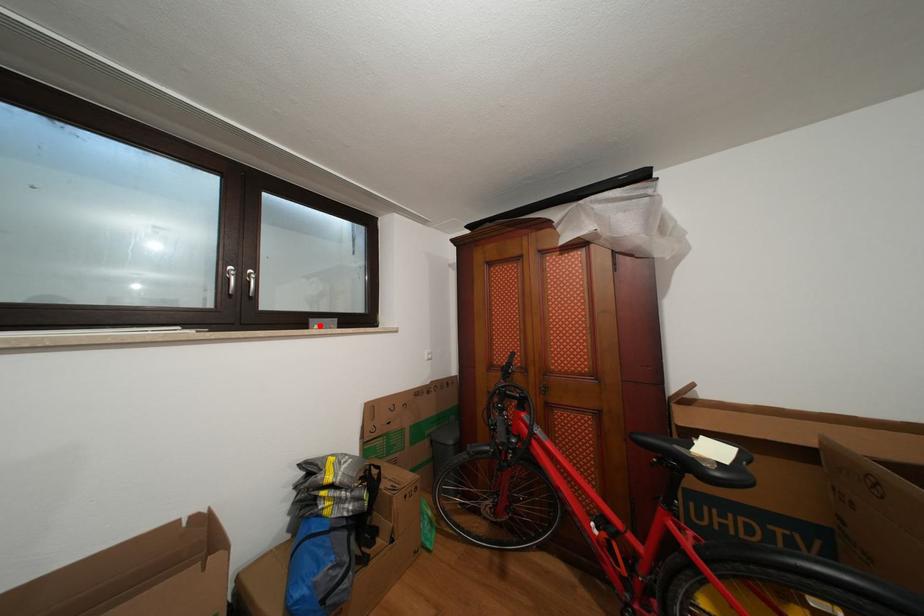
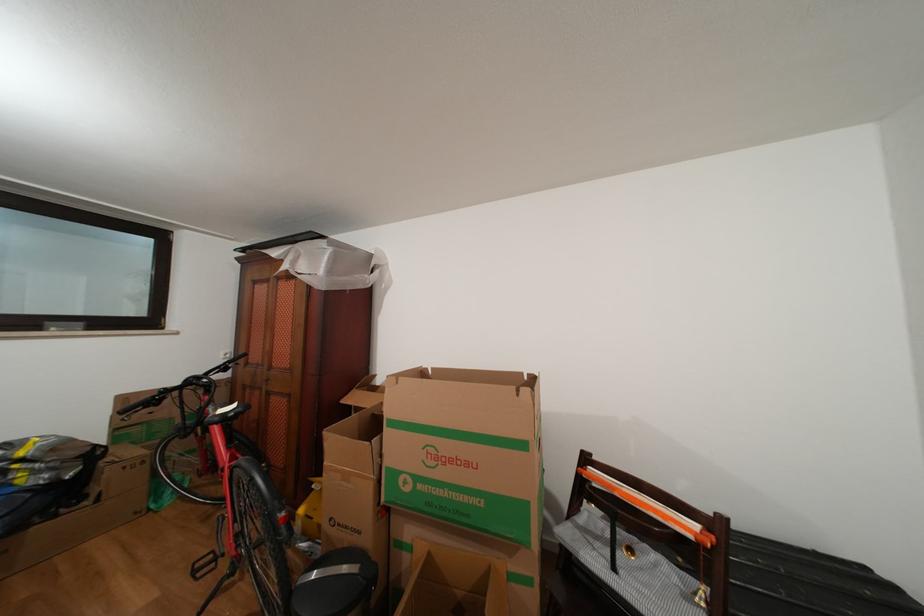
In the second image, find the point that corresponds to the highlighted location in the first image.

(56, 329)